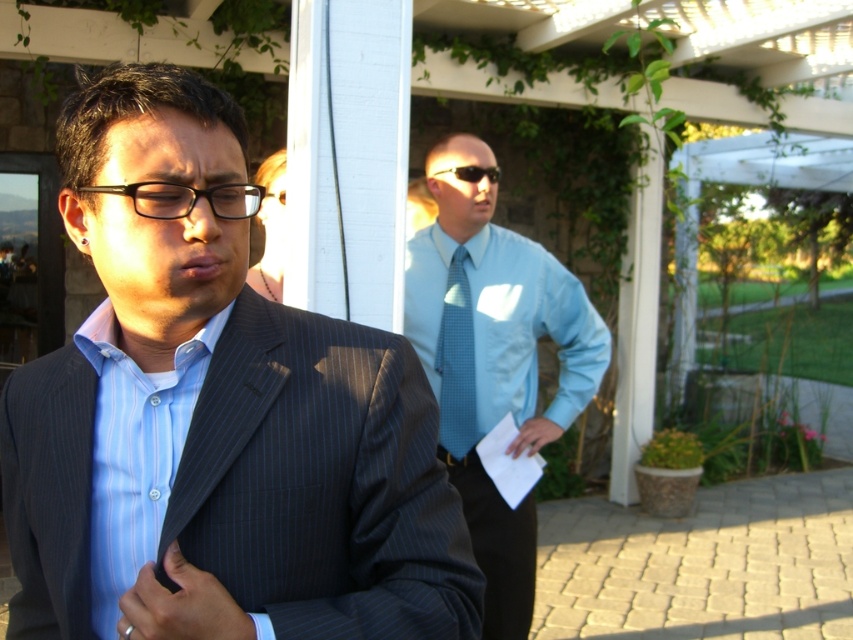
Can you confirm if light blue smooth dress shirt at center is smaller than sunglasses at center?

Actually, light blue smooth dress shirt at center might be larger than sunglasses at center.

Is light blue smooth dress shirt at center shorter than sunglasses at center?

Incorrect, light blue smooth dress shirt at center's height does not fall short of sunglasses at center's.

Describe the element at coordinates (527, 330) in the screenshot. The image size is (853, 640). I see `light blue smooth dress shirt at center` at that location.

Find the location of a particular element. Image resolution: width=853 pixels, height=640 pixels. light blue smooth dress shirt at center is located at coordinates (527, 330).

Which is in front, point (584, 401) or point (457, 412)?

Point (457, 412) is more forward.

Is light blue shirt at center positioned in front of blue textured tie at center?

Yes, light blue shirt at center is closer to the viewer.

Find the location of `light blue shirt at center`. light blue shirt at center is located at coordinates (494, 360).

Can you confirm if blue textured tie at center is taller than black plastic glasses at center?

Yes, blue textured tie at center is taller than black plastic glasses at center.

Can you confirm if blue textured tie at center is smaller than black plastic glasses at center?

No.

Who is more distant from viewer, (474, 420) or (225, 216)?

The point (474, 420) is behind.

This screenshot has height=640, width=853. I want to click on blue textured tie at center, so click(x=456, y=364).